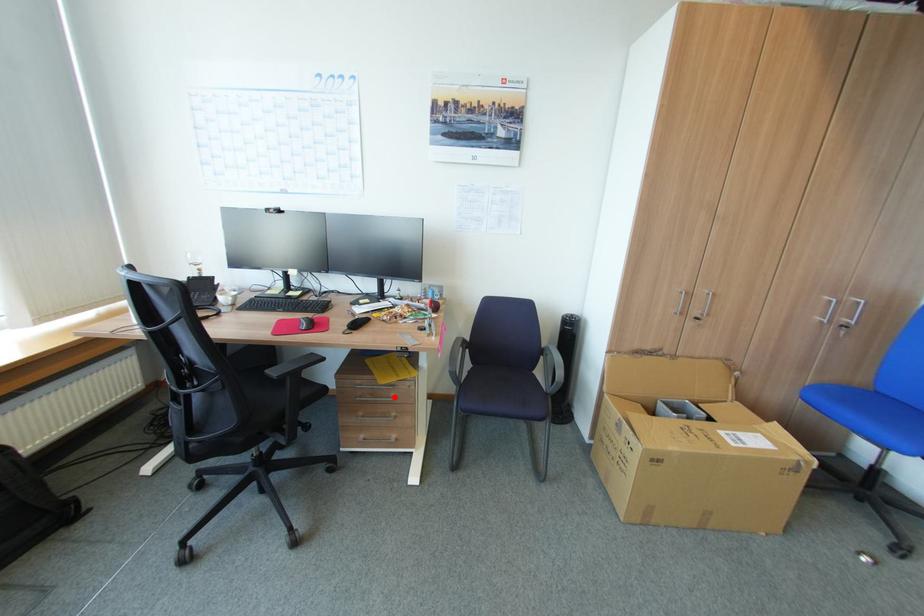
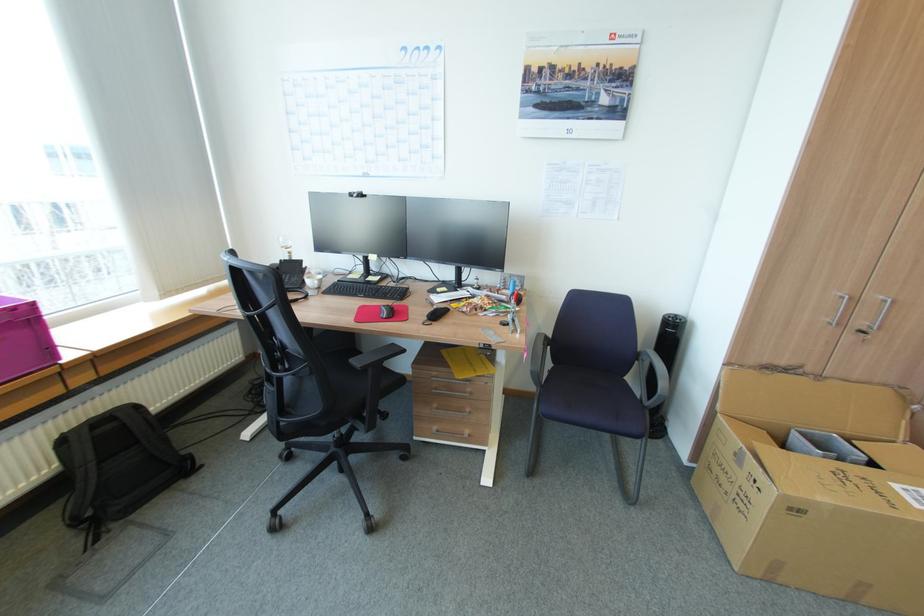
The point at the highlighted location is marked in the first image. Where is the corresponding point in the second image?

(469, 392)